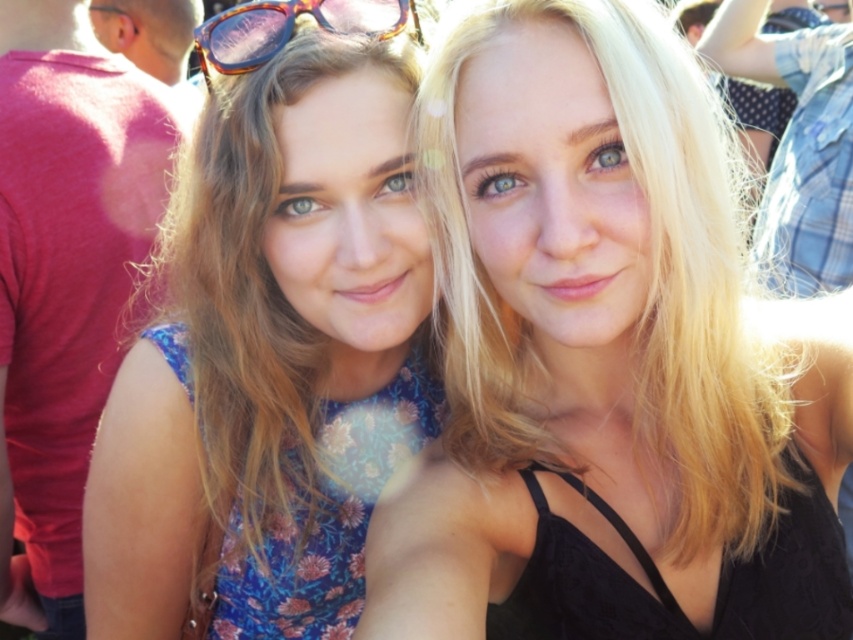
You are a GUI agent. You are given a task and a screenshot of the screen. Output one action in this format:
    pyautogui.click(x=<x>, y=<y>)
    Task: Click on the blonde hair at center
    The image size is (853, 640).
    Given the screenshot: What is the action you would take?
    pyautogui.click(x=605, y=362)

Based on the photo, is blonde hair at center above floral fabric dress at left?

Incorrect, blonde hair at center is not positioned above floral fabric dress at left.

Who is more forward, (x=577, y=252) or (x=202, y=192)?

Point (x=577, y=252) is in front.

Find the location of a particular element. This screenshot has width=853, height=640. blonde hair at center is located at coordinates (605, 362).

Can you confirm if floral fabric dress at left is taller than tortoiseshell plastic goggles at upper center?

Indeed, floral fabric dress at left has a greater height compared to tortoiseshell plastic goggles at upper center.

Is floral fabric dress at left to the left of tortoiseshell plastic goggles at upper center from the viewer's perspective?

Correct, you'll find floral fabric dress at left to the left of tortoiseshell plastic goggles at upper center.

Between point (277, 572) and point (218, 33), which one is positioned in front?

Point (218, 33) is in front.

Where is `floral fabric dress at left`? Image resolution: width=853 pixels, height=640 pixels. floral fabric dress at left is located at coordinates (270, 358).

Is blonde hair at center positioned before tortoiseshell plastic goggles at upper center?

Yes, blonde hair at center is in front of tortoiseshell plastic goggles at upper center.

Does blonde hair at center appear on the left side of tortoiseshell plastic goggles at upper center?

No, blonde hair at center is not to the left of tortoiseshell plastic goggles at upper center.

Is point (540, 262) less distant than point (234, 44)?

Yes, it is in front of point (234, 44).

The image size is (853, 640). I want to click on blonde hair at center, so click(x=605, y=362).